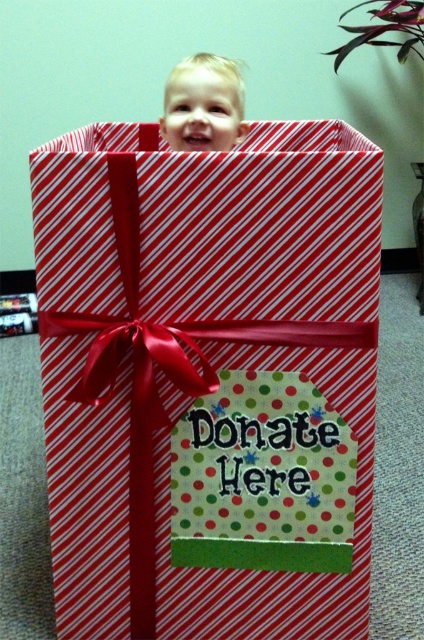
In the scene shown: You are a delivery person who needs to place a sticker on the exact center of the red striped gift box at center. The sticker has coordinates marked as point (209, 380). Is this point the correct location for the sticker?

Yes, the point (209, 380) corresponds to the red striped gift box at center, so placing the sticker there would be accurate.

You are a delivery person who just arrived at the house. You see the red striped gift box at center and the blonde hair toddler at upper center. The toddler is holding a small package that needs to be placed into the gift box. Can the toddler reach the gift box to place the package inside?

The red striped gift box at center and the blonde hair toddler at upper center are 21.04 inches apart. Since the toddler is at upper center and the box is at center, the distance between them is 21.04 inches. Assuming the toddler can reach about 18 inches, the distance is too far for the toddler to reach the gift box to place the package inside.

You are a delivery person who just arrived at the house. You see the red striped gift box at center and the blonde hair toddler at upper center. Which object is located higher up in the image?

The blonde hair toddler at upper center is higher up in the image because the red striped gift box at center is positioned under it.